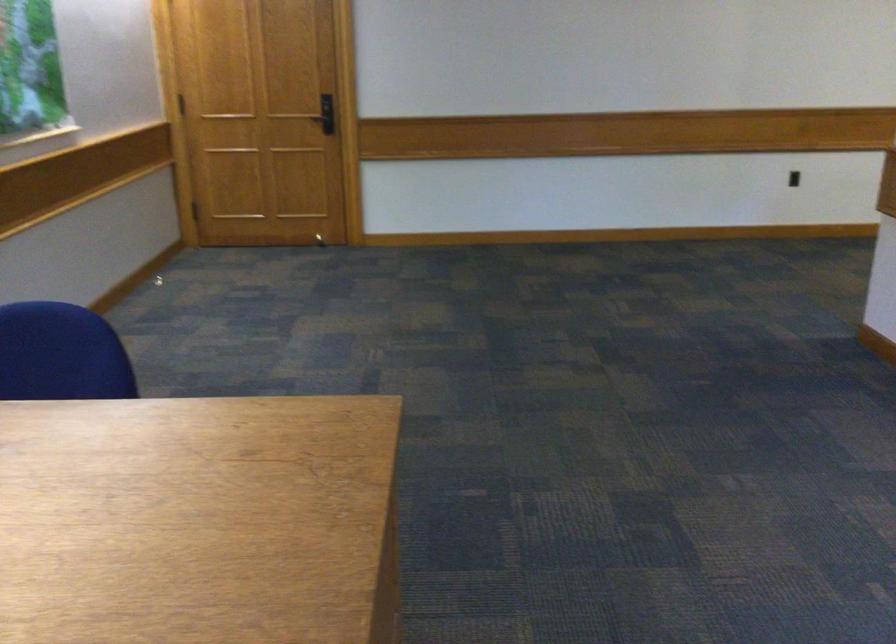
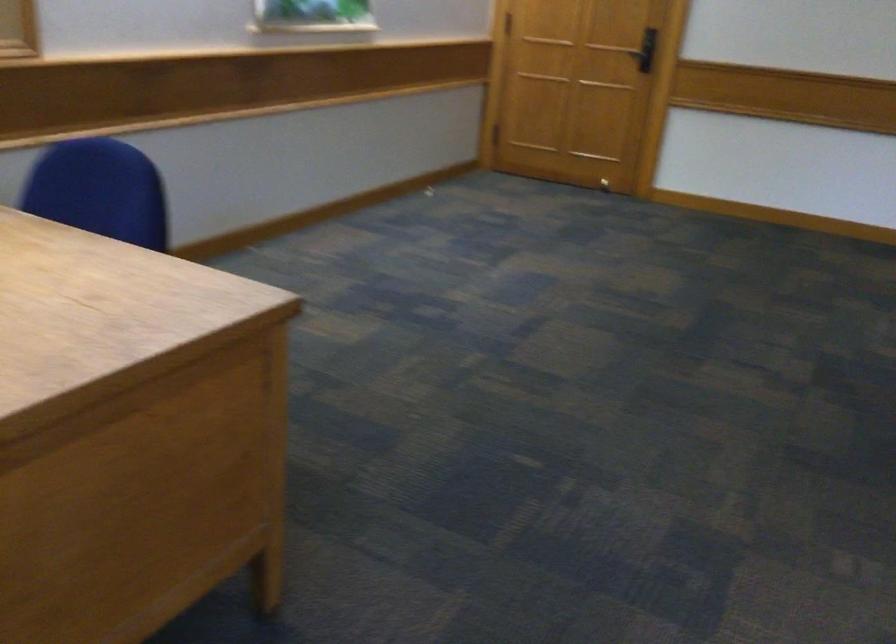
Question: The camera is either moving clockwise (left) or counter-clockwise (right) around the object. The first image is from the beginning of the video and the second image is from the end. Is the camera moving left or right when shooting the video?

Choices:
 (A) Left
 (B) Right

Answer: (B)